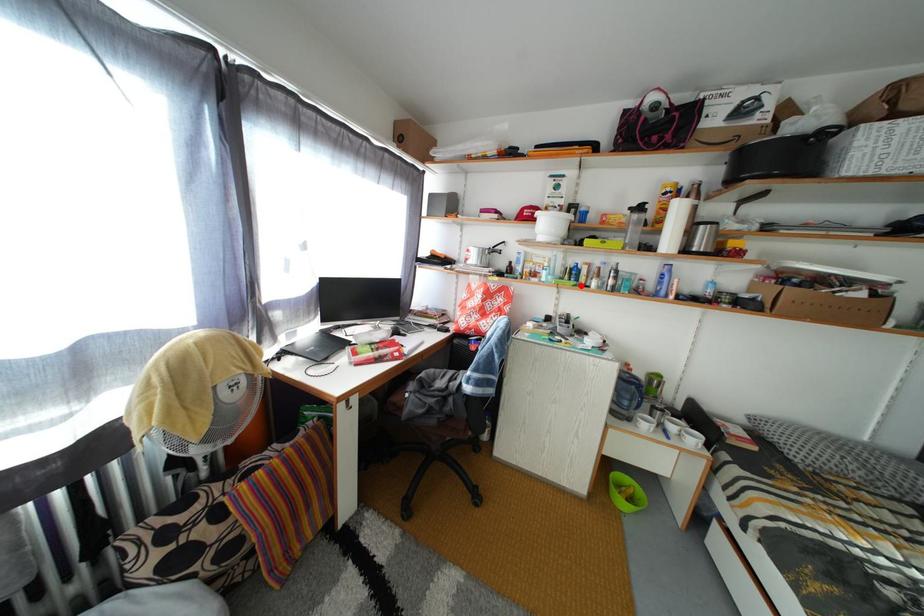
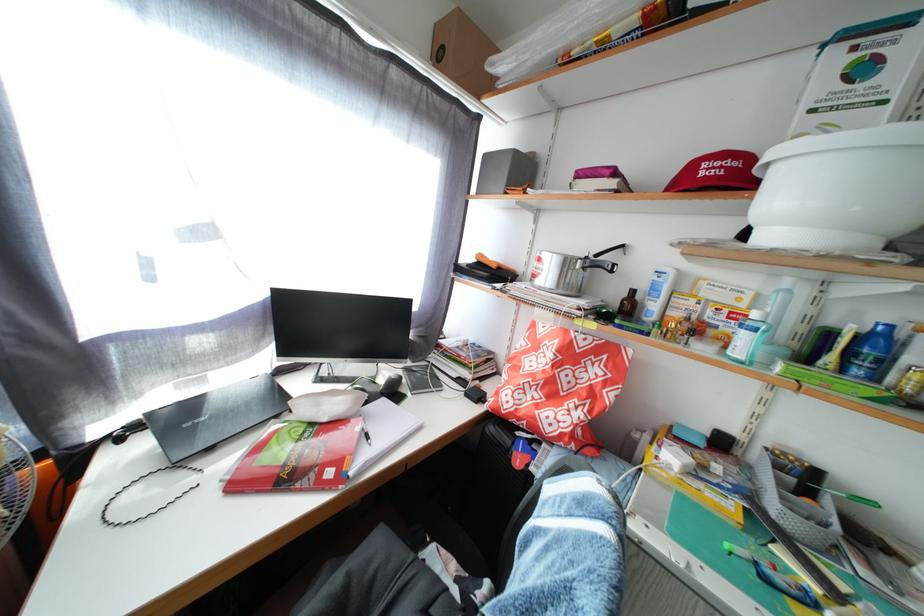
Question: I am providing you with two images of the same scene from different viewpoints. In image1, a red point is highlighted. Considering the same 3D point in image2, which of the following is correct?

Choices:
 (A) It is closer
 (B) It is farther

Answer: (B)